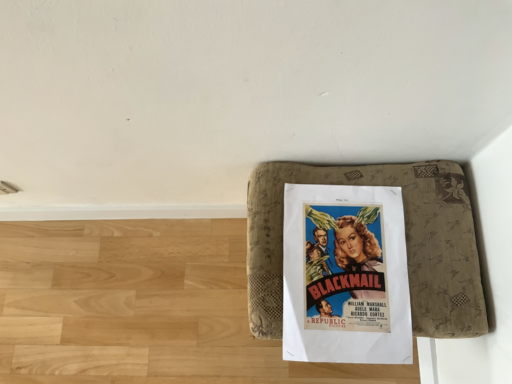
Where is `blank area to the left of matte paper poster at center`? The width and height of the screenshot is (512, 384). blank area to the left of matte paper poster at center is located at coordinates (192, 293).